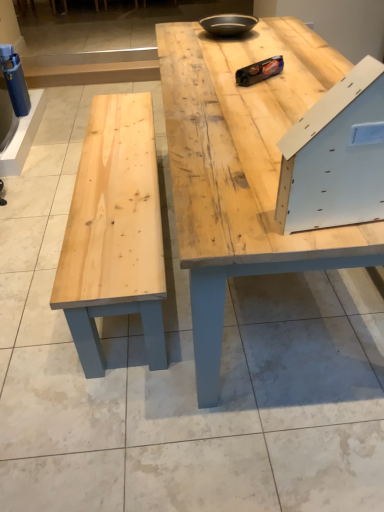
Question: Is natural wood table at center placed right next to matte black bowl at upper center?

Choices:
 (A) yes
 (B) no

Answer: (B)

Question: Can you confirm if natural wood table at center is thinner than matte black bowl at upper center?

Choices:
 (A) yes
 (B) no

Answer: (B)

Question: Can you confirm if natural wood table at center is positioned to the left of matte black bowl at upper center?

Choices:
 (A) yes
 (B) no

Answer: (B)

Question: Considering the relative sizes of natural wood table at center and matte black bowl at upper center in the image provided, is natural wood table at center wider than matte black bowl at upper center?

Choices:
 (A) yes
 (B) no

Answer: (A)

Question: From the image's perspective, is natural wood table at center below matte black bowl at upper center?

Choices:
 (A) yes
 (B) no

Answer: (A)

Question: From their relative heights in the image, would you say white matte drawer at upper right is taller or shorter than natural wood table at center?

Choices:
 (A) short
 (B) tall

Answer: (A)

Question: From the image's perspective, is white matte drawer at upper right positioned above or below natural wood table at center?

Choices:
 (A) below
 (B) above

Answer: (A)

Question: Is white matte drawer at upper right in front of or behind natural wood table at center in the image?

Choices:
 (A) front
 (B) behind

Answer: (A)

Question: Looking at their shapes, would you say white matte drawer at upper right is wider or thinner than natural wood table at center?

Choices:
 (A) thin
 (B) wide

Answer: (A)

Question: Relative to matte black bowl at upper center, is white matte drawer at upper right in front or behind?

Choices:
 (A) front
 (B) behind

Answer: (A)

Question: From a real-world perspective, is white matte drawer at upper right positioned above or below matte black bowl at upper center?

Choices:
 (A) above
 (B) below

Answer: (A)

Question: In terms of size, does white matte drawer at upper right appear bigger or smaller than matte black bowl at upper center?

Choices:
 (A) small
 (B) big

Answer: (B)

Question: From the image's perspective, is white matte drawer at upper right positioned above or below matte black bowl at upper center?

Choices:
 (A) above
 (B) below

Answer: (B)

Question: Would you say matte black bowl at upper center is inside or outside natural wood table at center?

Choices:
 (A) inside
 (B) outside

Answer: (B)

Question: Visually, is matte black bowl at upper center positioned to the left or to the right of natural wood table at center?

Choices:
 (A) right
 (B) left

Answer: (B)